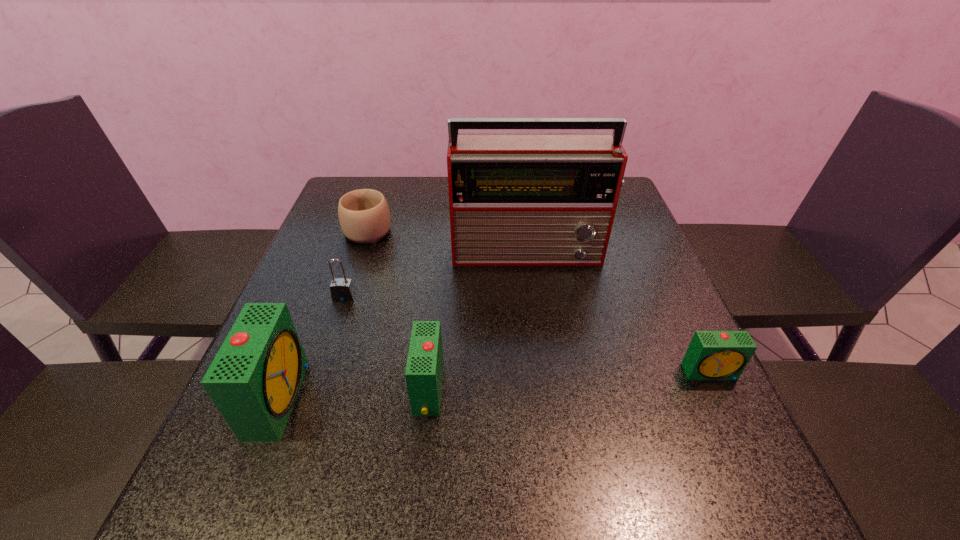
Find the location of a particular element. This screenshot has height=540, width=960. vacant point located on the front-facing side of the tallest alarm clock is located at coordinates (348, 398).

The width and height of the screenshot is (960, 540). In order to click on vacant space located on the front-facing side of the second alarm clock from left to right in this screenshot , I will do `click(328, 389)`.

At what (x,y) coordinates should I click in order to perform the action: click on free region located on the front-facing side of the second alarm clock from left to right. Please return your answer as a coordinate pair (x, y). Looking at the image, I should click on (302, 389).

The image size is (960, 540). Find the location of `vacant space located 0.290m on the front-facing side of the second alarm clock from left to right`. vacant space located 0.290m on the front-facing side of the second alarm clock from left to right is located at coordinates (259, 389).

The width and height of the screenshot is (960, 540). I want to click on free space located 0.130m on the front-facing side of the rightmost alarm clock, so click(x=745, y=445).

You are a GUI agent. You are given a task and a screenshot of the screen. Output one action in this format:
    pyautogui.click(x=<x>, y=<y>)
    Task: Click on the free location located on the front-facing side of the fifth object from left to right
    The image size is (960, 540).
    Given the screenshot: What is the action you would take?
    pyautogui.click(x=548, y=383)

Locate an element on the screen. This screenshot has width=960, height=540. free space located on the side of the mug with the handle is located at coordinates (384, 183).

Where is `free location located 0.200m on the side of the mug with the handle`? The height and width of the screenshot is (540, 960). free location located 0.200m on the side of the mug with the handle is located at coordinates (386, 178).

At what (x,y) coordinates should I click in order to perform the action: click on free location located on the side of the mug with the handle. Please return your answer as a coordinate pair (x, y). The image size is (960, 540). Looking at the image, I should click on (385, 181).

The image size is (960, 540). Find the location of `blank space located 0.280m on the shackle of the third farthest object`. blank space located 0.280m on the shackle of the third farthest object is located at coordinates (306, 410).